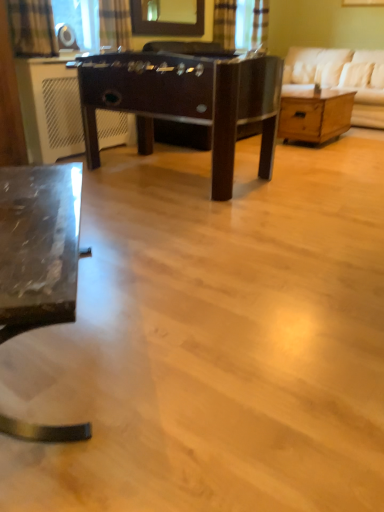
In order to click on free spot to the right of dark brown wood foosball table at center, the first table viewed from the front in this screenshot , I will do `click(317, 174)`.